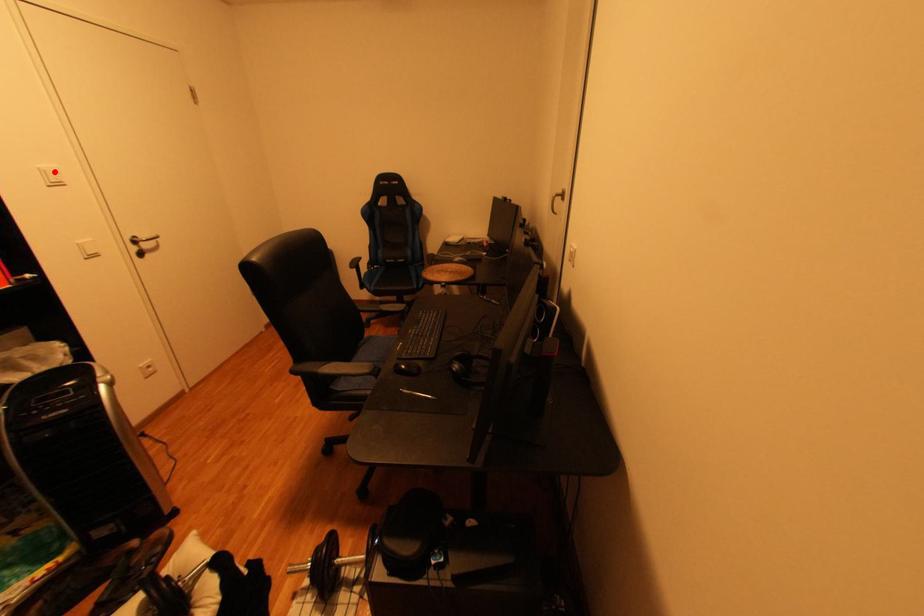
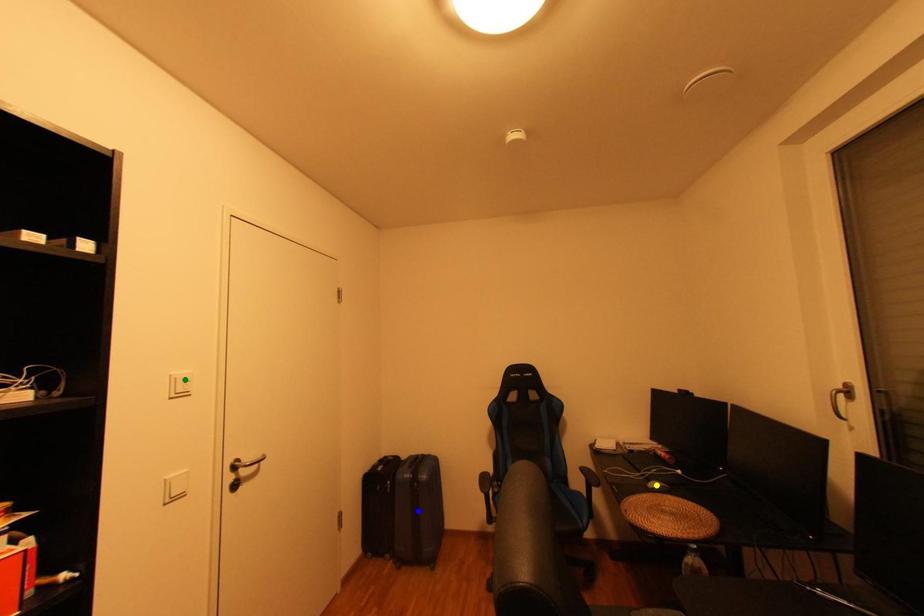
Question: I am providing you with two images of the same scene from different viewpoints. A red point is marked on the first image. You are given multiple points on the second image. In image 2, which mark is for the same physical point as the one in image 1?

Choices:
 (A) green point
 (B) blue point
 (C) yellow point

Answer: (A)